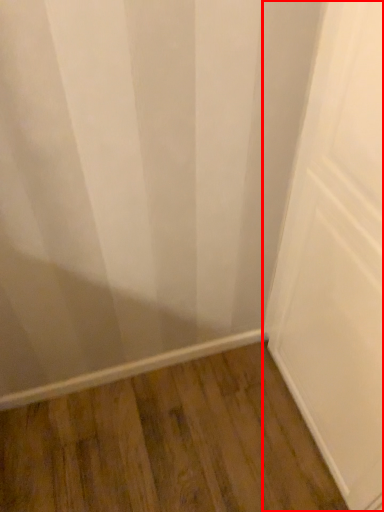
Question: From the image, what is the correct spatial relationship of door (annotated by the red box) in relation to hardwood?

Choices:
 (A) left
 (B) right

Answer: (B)